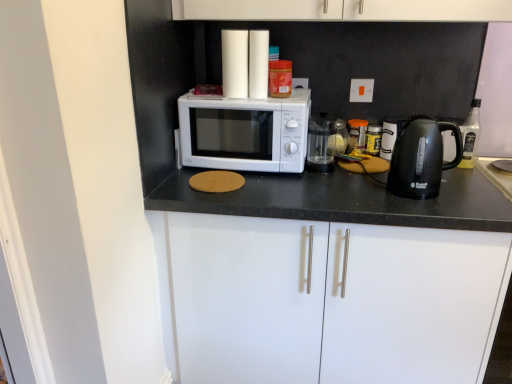
Find the location of a particular element. This screenshot has height=384, width=512. unoccupied area in front of black plastic kettle at right is located at coordinates (443, 208).